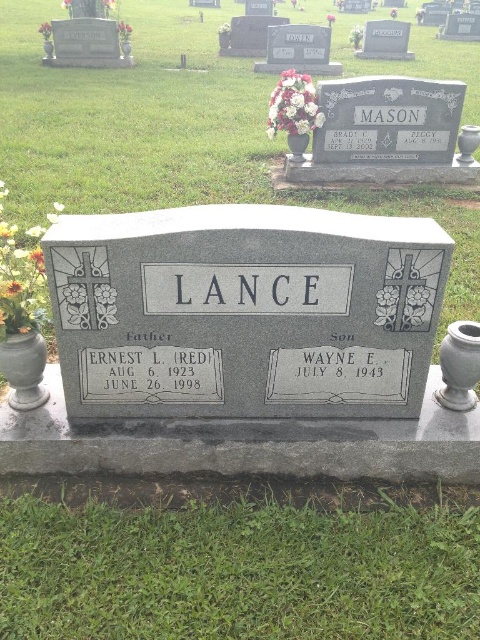
What is the exact coordinate of the gray metallic text at center?

The gray metallic text at center is located at point (245,288).

What is the significance of the point at coordinates (151, 374) in the image?

The point at coordinates (151, 374) corresponds to the black granite text at the center of the headstone, which is the surname LANCE inscribed at the top center.